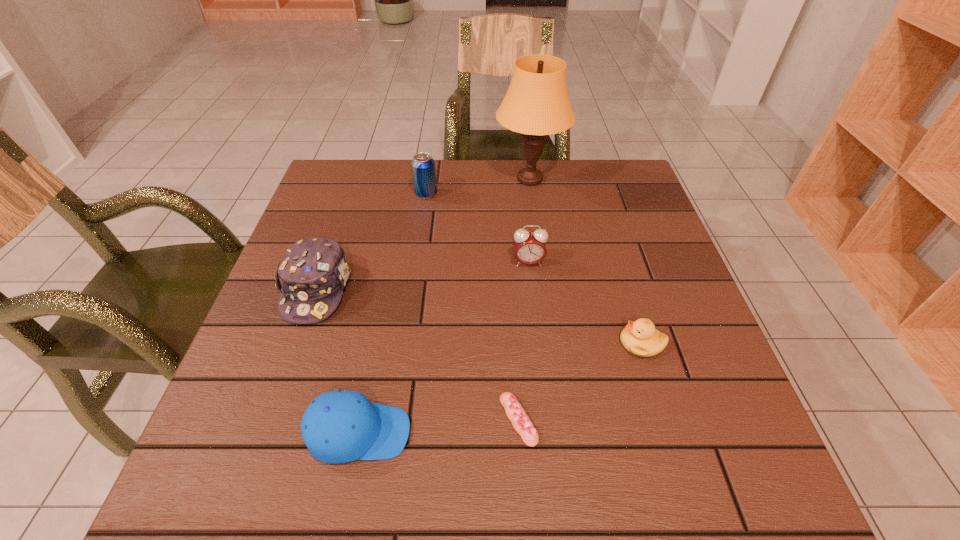
I want to click on free space located 0.090m on the front of the beer can, so click(422, 221).

I want to click on blank space located 0.340m on the clock face of the alarm clock, so click(543, 403).

Locate an element on the screen. free point located 0.180m on the front-facing side of the farther cap is located at coordinates (276, 407).

This screenshot has height=540, width=960. What are the coordinates of `blank space located 0.350m on the front-facing side of the third shortest object` in the screenshot? It's located at (616, 433).

Where is `vacant space located at the face of the rightmost object`? vacant space located at the face of the rightmost object is located at coordinates [x=428, y=343].

Locate an element on the screen. The width and height of the screenshot is (960, 540). vacant region located 0.330m at the face of the rightmost object is located at coordinates (454, 343).

The image size is (960, 540). I want to click on free space located 0.100m at the face of the rightmost object, so click(569, 343).

Locate an element on the screen. The height and width of the screenshot is (540, 960). vacant space located 0.100m on the right of the eclair is located at coordinates (594, 420).

Image resolution: width=960 pixels, height=540 pixels. I want to click on lampshade situated at the far edge, so pos(537,104).

The image size is (960, 540). In order to click on beer can situated at the far edge in this screenshot , I will do `click(423, 165)`.